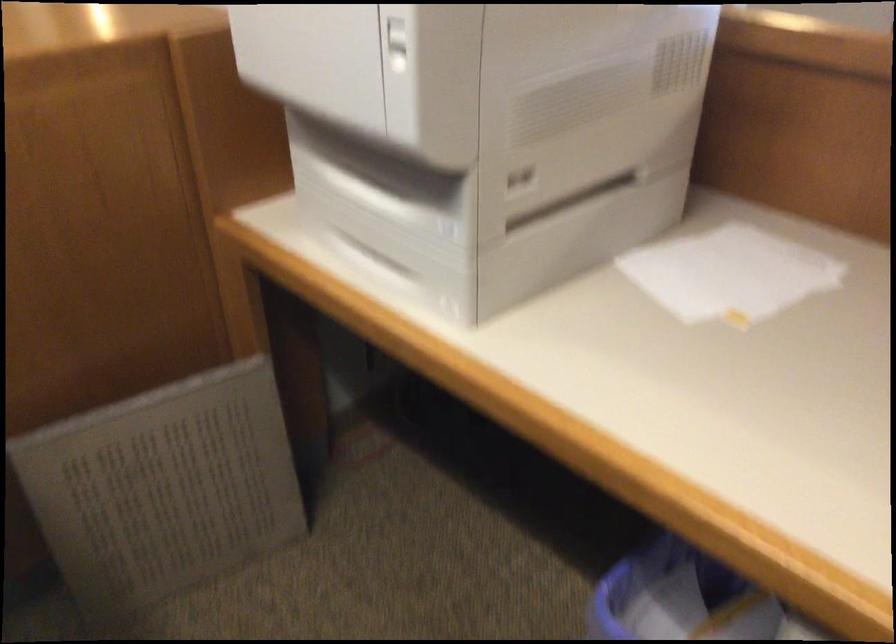
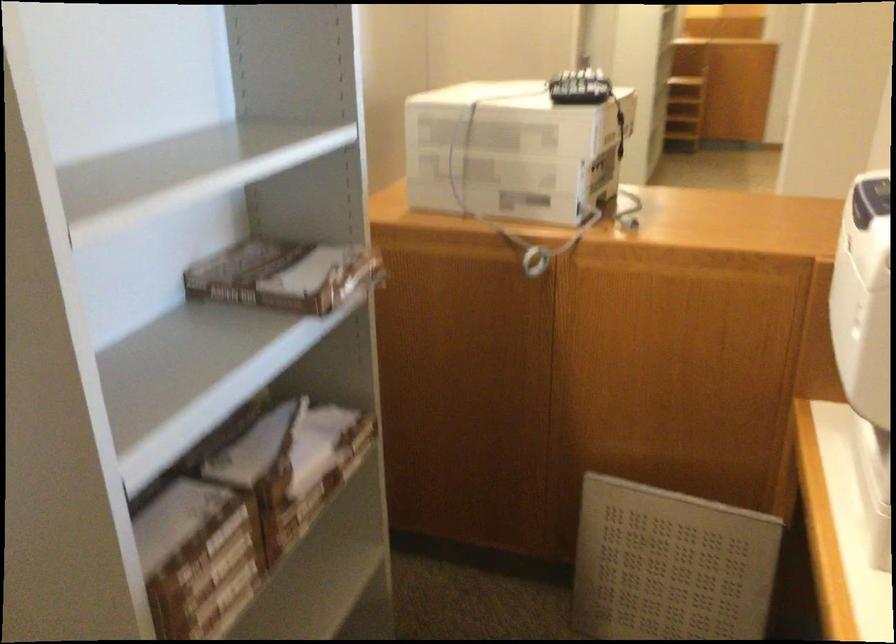
Find the pixel in the second image that matches point 205,468 in the first image.

(669, 565)